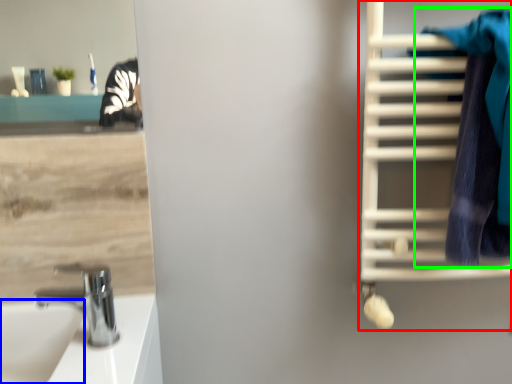
Question: Estimate the real-world distances between objects in this image. Which object is farther from bunk bed (highlighted by a red box), sink (highlighted by a blue box) or bath towel (highlighted by a green box)?

Choices:
 (A) sink
 (B) bath towel

Answer: (A)